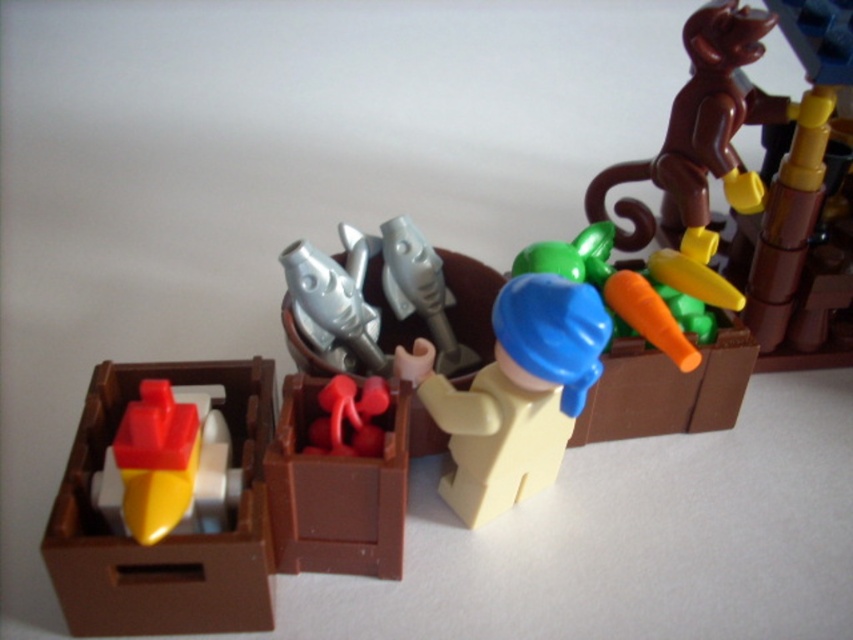
Can you confirm if brown matte monkey at upper right is positioned above smooth plastic carrot at upper right?

Correct, brown matte monkey at upper right is located above smooth plastic carrot at upper right.

What do you see at coordinates (701, 116) in the screenshot? This screenshot has height=640, width=853. I see `brown matte monkey at upper right` at bounding box center [701, 116].

The height and width of the screenshot is (640, 853). Find the location of `brown matte monkey at upper right`. brown matte monkey at upper right is located at coordinates (701, 116).

Can you confirm if matte brown box at left is shorter than smooth plastic carrot at upper right?

Incorrect, matte brown box at left's height does not fall short of smooth plastic carrot at upper right's.

Identify the location of matte brown box at left. (167, 538).

Is point (86, 557) farther from viewer compared to point (664, 353)?

That is False.

You are a GUI agent. You are given a task and a screenshot of the screen. Output one action in this format:
    pyautogui.click(x=<x>, y=<y>)
    Task: Click on the matte brown box at left
    
    Given the screenshot: What is the action you would take?
    pyautogui.click(x=167, y=538)

Is point (717, 68) closer to camera compared to point (119, 426)?

No.

Does brown matte monkey at upper right appear on the left side of shiny plastic boat at left?

No, brown matte monkey at upper right is not to the left of shiny plastic boat at left.

Is point (711, 122) positioned after point (125, 490)?

Yes, it is.

Locate an element on the screen. brown matte monkey at upper right is located at coordinates (701, 116).